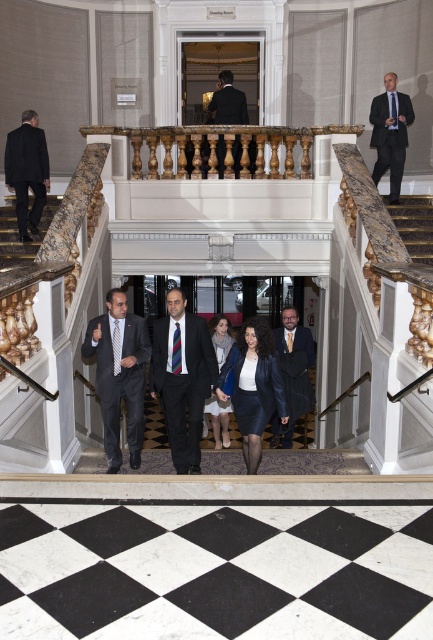
Is matte black suit at left behind matte black suit at upper right?

That is False.

Between matte black suit at left and matte black suit at upper right, which one is positioned higher?

matte black suit at upper right is higher up.

Is point (6, 154) in front of point (387, 106)?

Yes, it is in front of point (387, 106).

Locate an element on the screen. Image resolution: width=433 pixels, height=640 pixels. matte black suit at left is located at coordinates (26, 170).

Between point (394, 157) and point (32, 234), which one is positioned behind?

Positioned behind is point (394, 157).

Does matte black suit at upper right have a lesser width compared to marble stairs at lower left?

Correct, matte black suit at upper right's width is less than marble stairs at lower left's.

Does point (387, 140) come farther from viewer compared to point (34, 246)?

Yes.

Locate an element on the screen. matte black suit at upper right is located at coordinates (390, 132).

Which is more to the left, matte gray suit at center or black matte suit at upper center?

matte gray suit at center is more to the left.

Can you confirm if matte gray suit at center is thinner than black matte suit at upper center?

Incorrect, matte gray suit at center's width is not less than black matte suit at upper center's.

This screenshot has width=433, height=640. What are the coordinates of `matte gray suit at center` in the screenshot? It's located at (119, 381).

Identify the location of matte gray suit at center. (119, 381).